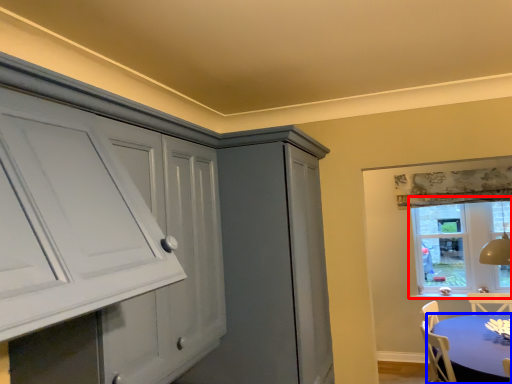
Question: Which point is further to the camera, window (highlighted by a red box) or table (highlighted by a blue box)?

Choices:
 (A) window
 (B) table

Answer: (A)